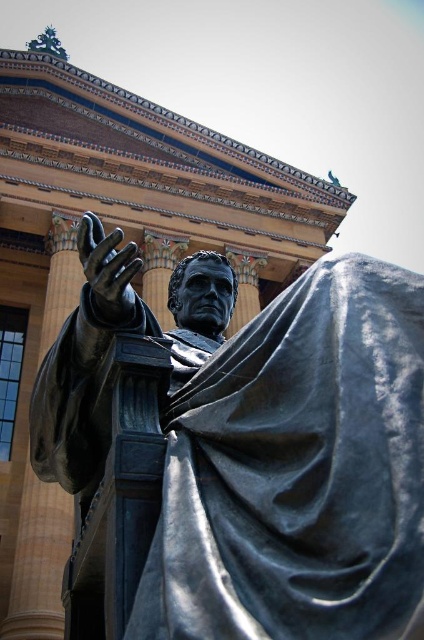
You are an art student analyzing the spatial arrangement of the bronze statue at center and the shiny bronze hand at center. Which object is closer to the viewer?

The bronze statue at center is closer to the viewer than the shiny bronze hand at center because it is positioned in front of it.

You are an art conservator examining the bronze statue at center and the shiny bronze hand at center. Based on their positions, which object is located higher up?

The shiny bronze hand at center is positioned higher up than the bronze statue at center.